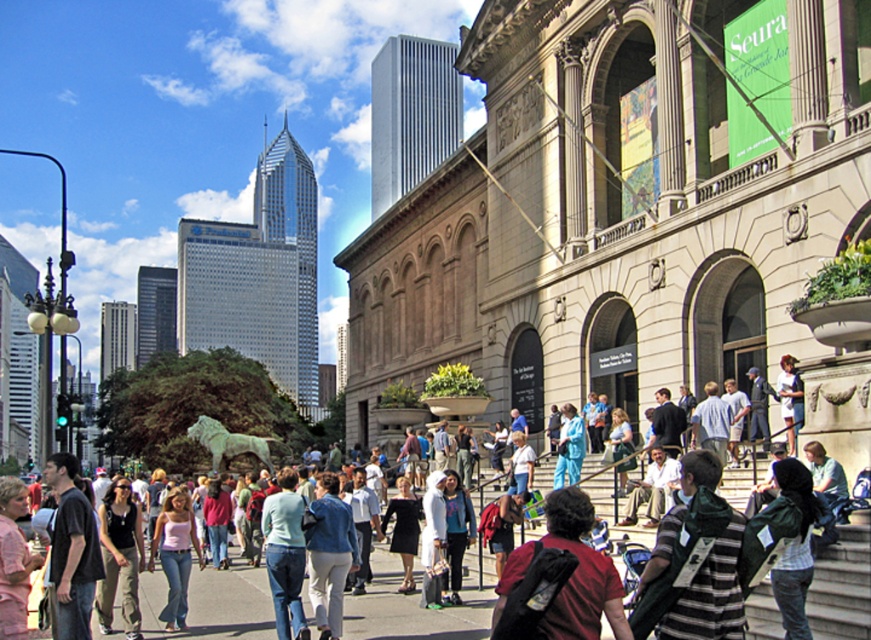
Question: In this image, where is dark green backpack at center located relative to light blue fabric at center?

Choices:
 (A) below
 (B) above

Answer: (A)

Question: Does striped cotton shirt at center appear under light blue fabric at center?

Choices:
 (A) no
 (B) yes

Answer: (B)

Question: Estimate the real-world distances between objects in this image. Which object is closer to the dark green backpack at center?

Choices:
 (A) striped cotton shirt at center
 (B) pink fabric shirt at lower left
 (C) light blue fabric at center

Answer: (A)

Question: Which of the following is the closest to the observer?

Choices:
 (A) (822, 572)
 (B) (88, 504)
 (C) (562, 472)

Answer: (A)

Question: Which object is the closest to the red shirt at center?

Choices:
 (A) pink fabric shirt at lower left
 (B) light blue fabric at center

Answer: (A)

Question: Is red shirt at center smaller than dark gray t-shirt at center?

Choices:
 (A) yes
 (B) no

Answer: (A)